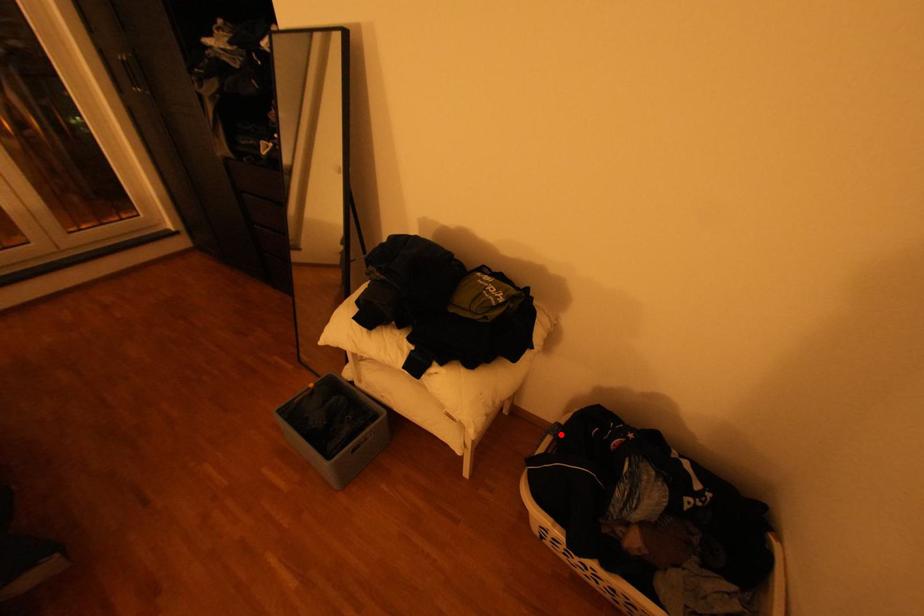
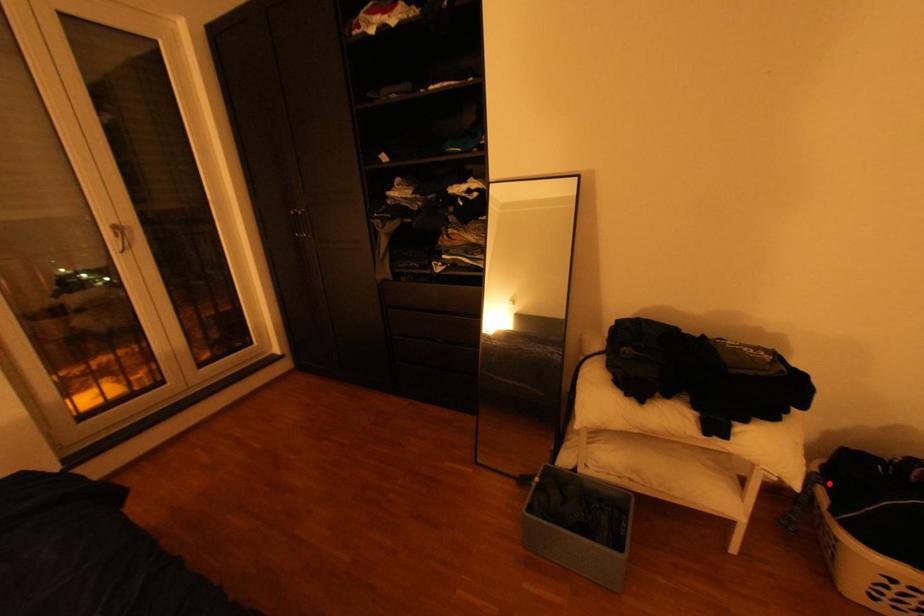
I am providing you with two images of the same scene from different viewpoints. A red point is marked on the first image and another point is marked on the second image. Does the point marked in image1 correspond to the same location as the one in image2?

Yes